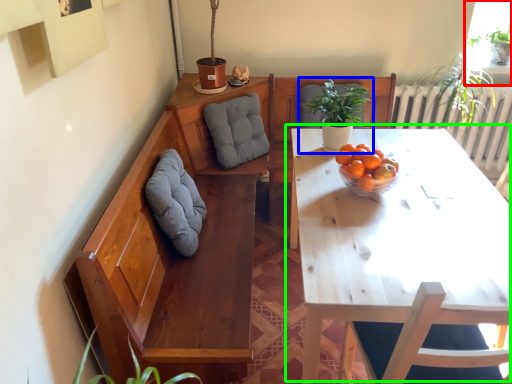
Question: Which is farther away from window (highlighted by a red box)? houseplant (highlighted by a blue box) or table (highlighted by a green box)?

Choices:
 (A) houseplant
 (B) table

Answer: (B)